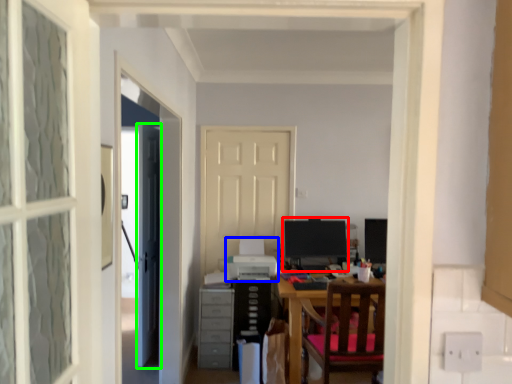
Question: Estimate the real-world distances between objects in this image. Which object is closer to computer monitor (highlighted by a red box), printer (highlighted by a blue box) or door (highlighted by a green box)?

Choices:
 (A) printer
 (B) door

Answer: (A)